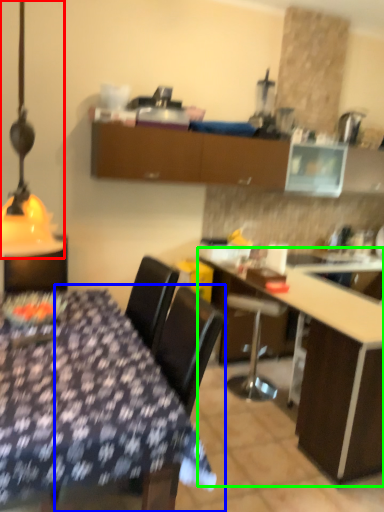
Question: Which object is positioned farthest from table lamp (highlighted by a red box)? Select from chair (highlighted by a blue box) and table (highlighted by a green box).

Choices:
 (A) chair
 (B) table

Answer: (B)